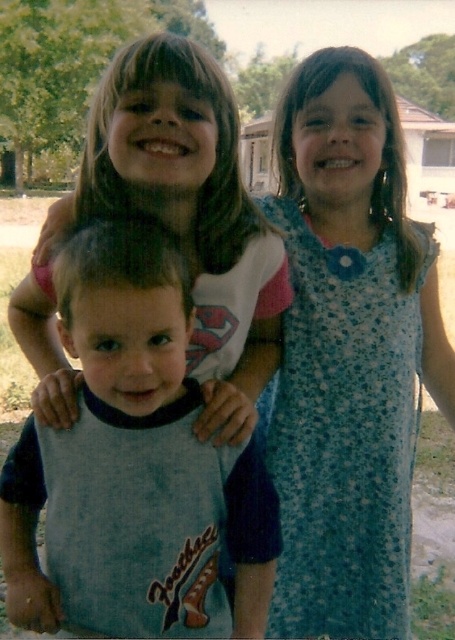
Is blue floral dress at upper right wider than matte white shirt at upper center?

Correct, the width of blue floral dress at upper right exceeds that of matte white shirt at upper center.

Can you confirm if blue floral dress at upper right is shorter than matte white shirt at upper center?

Incorrect, blue floral dress at upper right's height does not fall short of matte white shirt at upper center's.

Describe the element at coordinates (348, 353) in the screenshot. This screenshot has height=640, width=455. I see `blue floral dress at upper right` at that location.

Where is `blue floral dress at upper right`? blue floral dress at upper right is located at coordinates (348, 353).

This screenshot has height=640, width=455. What do you see at coordinates (134, 467) in the screenshot?
I see `blue cotton shirt at center` at bounding box center [134, 467].

Between point (203, 605) and point (126, 204), which one is positioned behind?

The point (126, 204) is behind.

The height and width of the screenshot is (640, 455). Find the location of `blue cotton shirt at center`. blue cotton shirt at center is located at coordinates (134, 467).

Where is `blue cotton shirt at center`? blue cotton shirt at center is located at coordinates (134, 467).

Which of these two, blue floral dress at upper right or blue cotton shirt at center, stands taller?

Standing taller between the two is blue floral dress at upper right.

What do you see at coordinates (348, 353) in the screenshot?
I see `blue floral dress at upper right` at bounding box center [348, 353].

Locate an element on the screen. The height and width of the screenshot is (640, 455). blue floral dress at upper right is located at coordinates (348, 353).